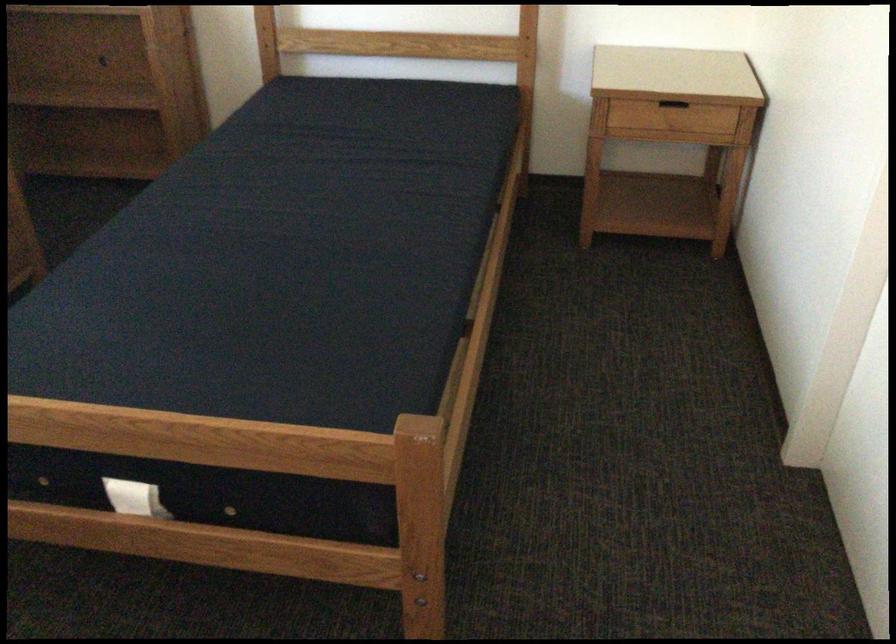
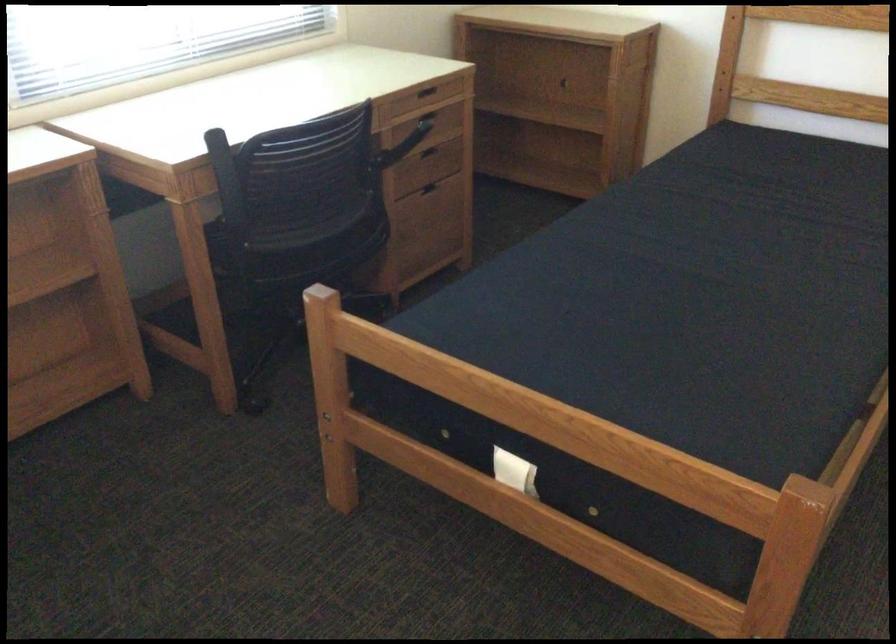
Question: The camera is either moving clockwise (left) or counter-clockwise (right) around the object. The first image is from the beginning of the video and the second image is from the end. Is the camera moving left or right when shooting the video?

Choices:
 (A) Left
 (B) Right

Answer: (B)